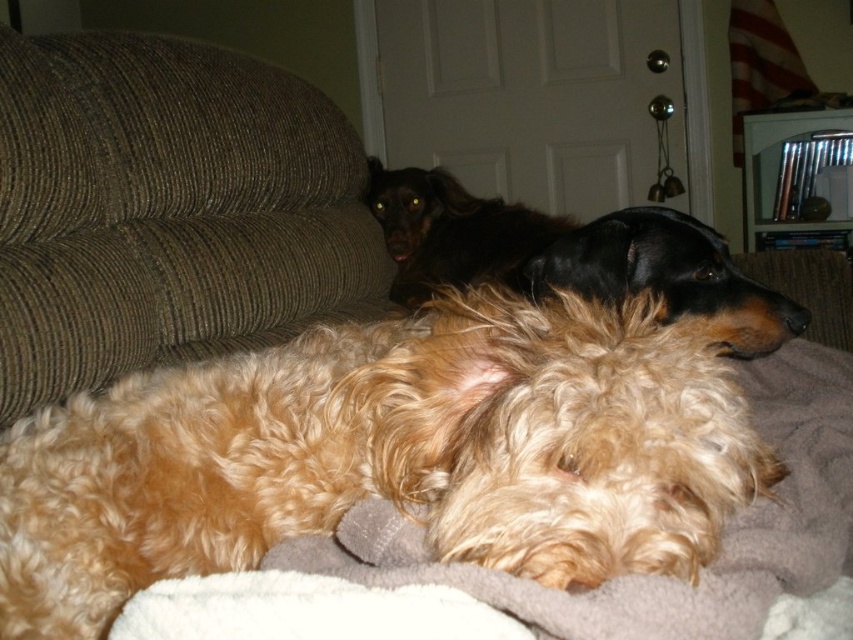
Question: Estimate the real-world distances between objects in this image. Which object is farther from the shiny black coat at upper center?

Choices:
 (A) black fur at center
 (B) brown corduroy couch at upper left

Answer: (B)

Question: Which point is closer to the camera?

Choices:
 (A) golden curly fur dog at center
 (B) black fur at center
 (C) shiny black coat at upper center
 (D) brown corduroy couch at upper left

Answer: (A)

Question: Is golden curly fur dog at center smaller than black fur at center?

Choices:
 (A) yes
 (B) no

Answer: (A)

Question: Does shiny black coat at upper center have a greater width compared to black fur at center?

Choices:
 (A) yes
 (B) no

Answer: (A)

Question: Considering the relative positions of golden curly fur dog at center and black fur at center in the image provided, where is golden curly fur dog at center located with respect to black fur at center?

Choices:
 (A) below
 (B) above

Answer: (A)

Question: Which point is farther to the camera?

Choices:
 (A) (320, 276)
 (B) (724, 330)
 (C) (3, 605)
 (D) (508, 212)

Answer: (D)